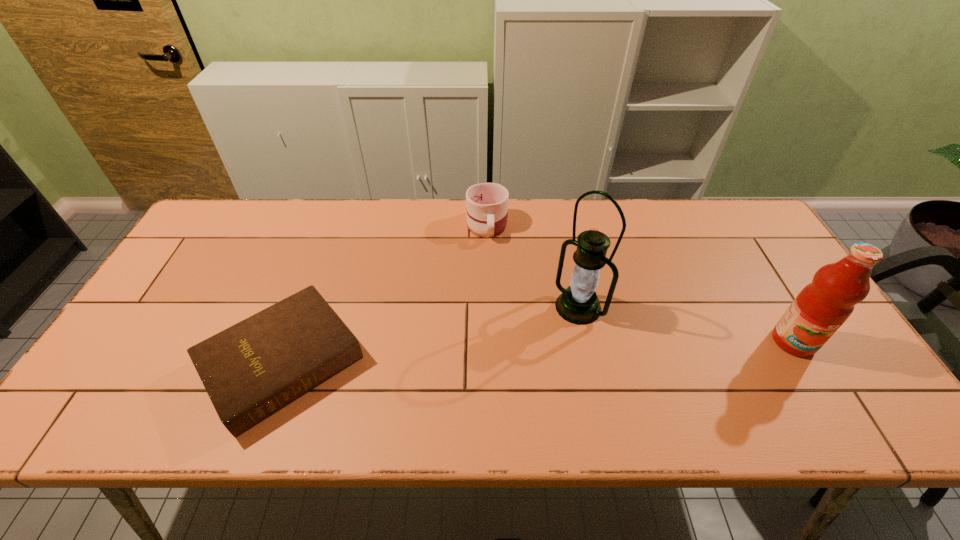
Where is `vacant space situated 0.130m on the side where the tallest object emits light`? The image size is (960, 540). vacant space situated 0.130m on the side where the tallest object emits light is located at coordinates (532, 349).

Identify the location of vacant area situated 0.120m on the side where the tallest object emits light. The image size is (960, 540). (535, 347).

The width and height of the screenshot is (960, 540). What are the coordinates of `free space located on the side where the tallest object emits light` in the screenshot? It's located at (518, 361).

Find the location of `vacant area situated on the side with the handle of the farthest object`. vacant area situated on the side with the handle of the farthest object is located at coordinates (489, 303).

You are a GUI agent. You are given a task and a screenshot of the screen. Output one action in this format:
    pyautogui.click(x=<x>, y=<y>)
    Task: Click on the vacant area situated on the side with the handle of the farthest object
    
    Given the screenshot: What is the action you would take?
    pyautogui.click(x=488, y=276)

The image size is (960, 540). I want to click on vacant region located on the side with the handle of the farthest object, so click(x=489, y=281).

This screenshot has height=540, width=960. I want to click on object that is at the far edge, so click(486, 203).

Identify the location of object that is at the near edge. This screenshot has width=960, height=540. (251, 370).

The width and height of the screenshot is (960, 540). Identify the location of object that is at the right edge. (822, 306).

The height and width of the screenshot is (540, 960). In the image, there is a desktop. In order to click on vacant space at the far edge in this screenshot , I will do `click(426, 241)`.